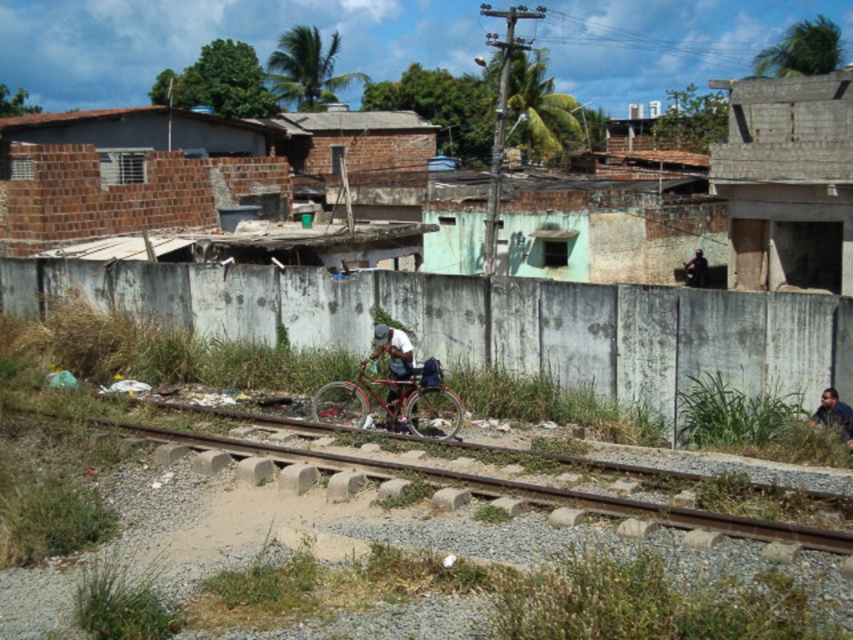
You are standing at the point closest to the viewer between the two points, point (445, 387) and point (846, 442). Which point are you standing at?

You are standing at point (445, 387) because it is further to the viewer than point (846, 442).

You are a delivery person who needs to secure your bag properly to avoid it falling off the bicycle. Looking at the image, where is the dark blue fabric bag at center located relative to the dark blue fabric shirt at lower right?

The dark blue fabric bag at center is above the dark blue fabric shirt at lower right because the shirt is positioned under the bag.

You are a delivery person who needs to carry a large package. The package is wider than the metallic red bicycle at center. Can you attach this package to the dark blue fabric bag at center without exceeding the bag width?

The metallic red bicycle at center is wider than the dark blue fabric bag at center. Since the package is wider than the bicycle, it would also be wider than the bag, making it impossible to attach the package to the dark blue fabric bag at center without exceeding its width.